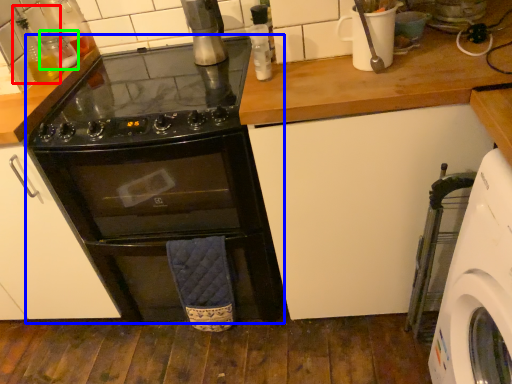
Question: Which is farther away from bottle (highlighted by a red box)? oven (highlighted by a blue box) or bottle (highlighted by a green box)?

Choices:
 (A) oven
 (B) bottle

Answer: (A)